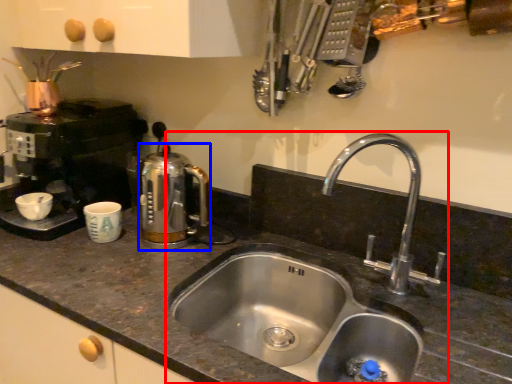
Question: Which object is closer to the camera taking this photo, sink (highlighted by a red box) or coffeepot (highlighted by a blue box)?

Choices:
 (A) sink
 (B) coffeepot

Answer: (A)